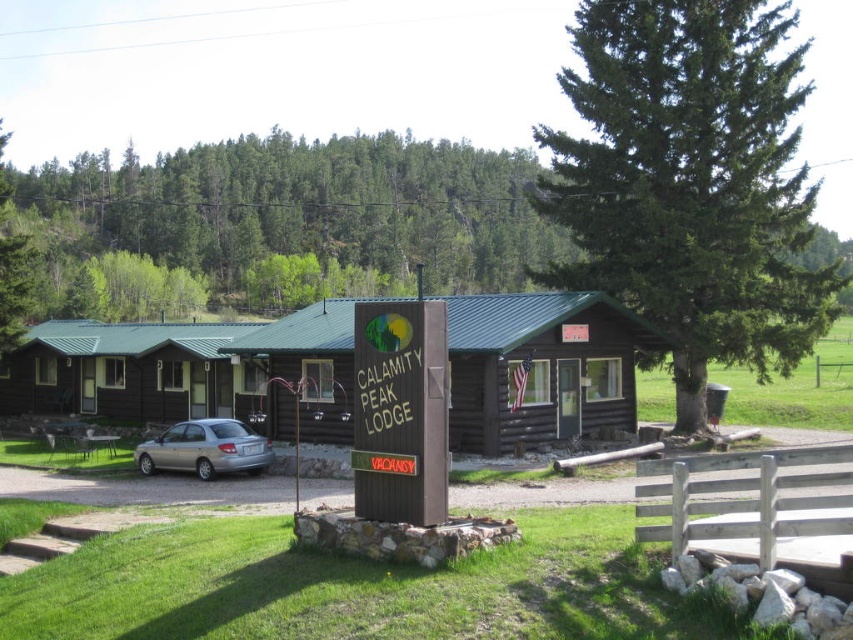
Question: In this image, where is green coniferous tree at center located relative to brown log cabin at center?

Choices:
 (A) right
 (B) left

Answer: (A)

Question: Which point appears farthest from the camera in this image?

Choices:
 (A) (581, 106)
 (B) (585, 328)
 (C) (18, 401)
 (D) (22, 182)

Answer: (D)

Question: Considering the real-world distances, which object is closest to the green coniferous tree at center?

Choices:
 (A) brown wooden picnic table at lower left
 (B) brown log cabin at left
 (C) satin silver sedan at lower left

Answer: (B)

Question: From the image, what is the correct spatial relationship of green leafy tree at upper center in relation to satin silver sedan at lower left?

Choices:
 (A) left
 (B) right

Answer: (A)

Question: Can you confirm if brown log cabin at left is positioned above brown wooden picnic table at lower left?

Choices:
 (A) yes
 (B) no

Answer: (A)

Question: Which point is closer to the camera taking this photo?

Choices:
 (A) [x=132, y=372]
 (B) [x=601, y=109]
 (C) [x=148, y=452]
 (D) [x=48, y=248]

Answer: (C)